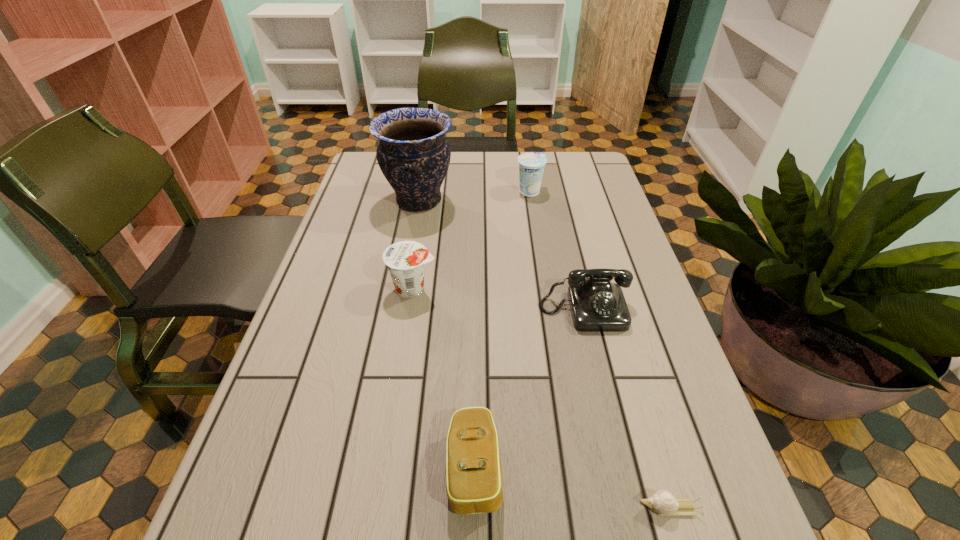
The image size is (960, 540). Identify the location of free space between the telephone and the clutch bag. (530, 389).

I want to click on free space between the telephone and the nearer yogurt, so click(499, 300).

In order to click on empty space that is in between the escargot and the fourth object from right to left in this screenshot , I will do `click(572, 488)`.

Where is `empty space between the right yogurt and the left yogurt`? empty space between the right yogurt and the left yogurt is located at coordinates (471, 240).

Locate an element on the screen. object that stands as the third closest to the farther yogurt is located at coordinates (405, 260).

Identify which object is the fourth closest to the telephone. Please provide its 2D coordinates. Your answer should be formatted as a tuple, i.e. [(x, y)], where the tuple contains the x and y coordinates of a point satisfying the conditions above.

[(662, 502)]

You are a GUI agent. You are given a task and a screenshot of the screen. Output one action in this format:
    pyautogui.click(x=<x>, y=<y>)
    Task: Click on the vacant area in the image that satisfies the following two spatial constraints: 1. on the front side of the farther yogurt; 2. on the front handle of the pottery
    The height and width of the screenshot is (540, 960).
    Given the screenshot: What is the action you would take?
    pyautogui.click(x=531, y=201)

The width and height of the screenshot is (960, 540). I want to click on vacant position in the image that satisfies the following two spatial constraints: 1. on the front handle of the tallest object; 2. on the right side of the nearer yogurt, so click(403, 289).

The width and height of the screenshot is (960, 540). Identify the location of free space that satisfies the following two spatial constraints: 1. on the back side of the nearer yogurt; 2. on the right side of the right yogurt. (429, 192).

Identify the location of free region that satisfies the following two spatial constraints: 1. on the front side of the farther yogurt; 2. on the zipper side of the third object from left to right. This screenshot has width=960, height=540. coord(571,468).